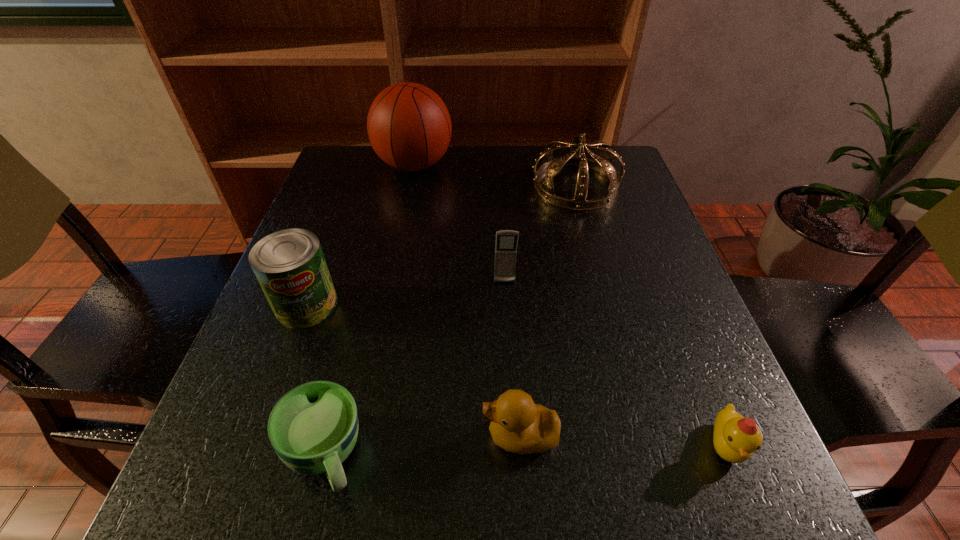
The image size is (960, 540). Find the location of `vacant area between the cellular telephone and the cup`. vacant area between the cellular telephone and the cup is located at coordinates (415, 368).

The width and height of the screenshot is (960, 540). Find the location of `the closest object to the basketball`. the closest object to the basketball is located at coordinates (602, 163).

Locate an element on the screen. object that is the sixth closest to the left duckling is located at coordinates coord(409,127).

Locate an element on the screen. Image resolution: width=960 pixels, height=540 pixels. free space that satisfies the following two spatial constraints: 1. on the back side of the cup; 2. on the left side of the tiara is located at coordinates (392, 186).

Locate an element on the screen. This screenshot has width=960, height=540. vacant space that satisfies the following two spatial constraints: 1. on the front side of the tiara; 2. facing forward on the left duckling is located at coordinates point(643,436).